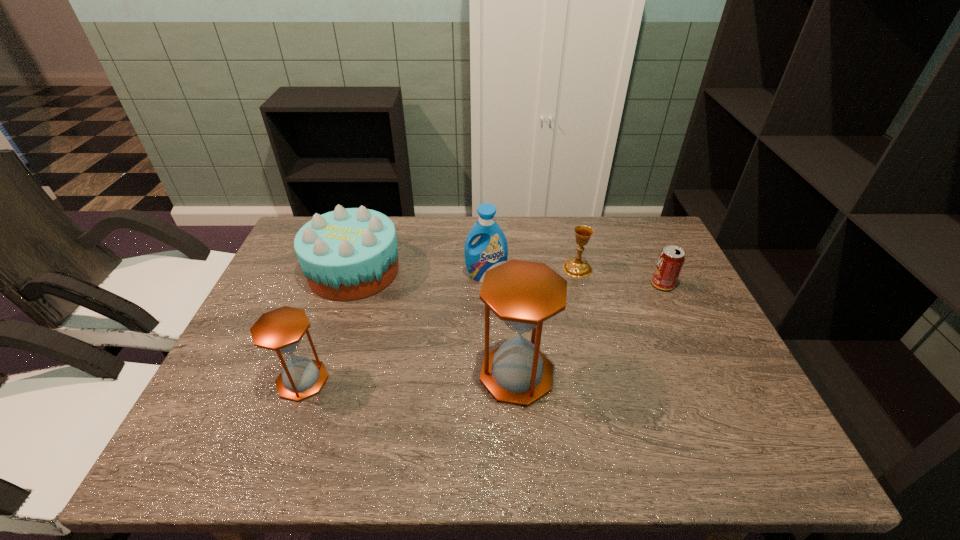
You are a GUI agent. You are given a task and a screenshot of the screen. Output one action in this format:
    pyautogui.click(x=<x>, y=<y>)
    Task: Click on the shorter hourglass
    
    Given the screenshot: What is the action you would take?
    pyautogui.click(x=281, y=330)

The width and height of the screenshot is (960, 540). Identify the location of the taller hourglass. (523, 294).

Find the location of a particular element. the tallest object is located at coordinates (523, 294).

Locate an element on the screen. The width and height of the screenshot is (960, 540). chalice is located at coordinates (575, 267).

Where is `cake`? cake is located at coordinates (348, 254).

Locate an element on the screen. the shortest object is located at coordinates (671, 259).

Where is `soda can`? The width and height of the screenshot is (960, 540). soda can is located at coordinates (671, 259).

You are a GUI agent. You are given a task and a screenshot of the screen. Output one action in this format:
    pyautogui.click(x=<x>, y=<y>)
    Task: Click on the detergent
    The height and width of the screenshot is (540, 960).
    Given the screenshot: What is the action you would take?
    pyautogui.click(x=491, y=250)

Where is `vacant area located on the back of the left hourglass`? The image size is (960, 540). vacant area located on the back of the left hourglass is located at coordinates (346, 262).

The width and height of the screenshot is (960, 540). I want to click on free region located 0.250m on the left of the tallest object, so click(371, 374).